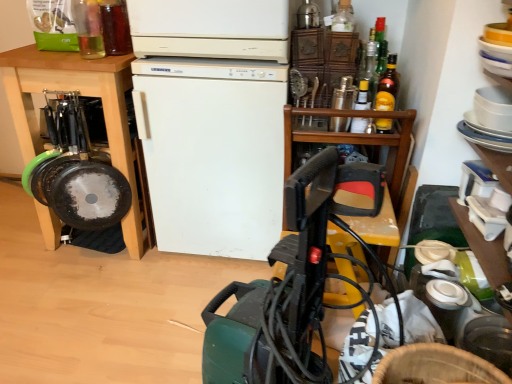
Find the location of a particular element. The height and width of the screenshot is (384, 512). free space in front of wooden cabinet at left is located at coordinates (92, 296).